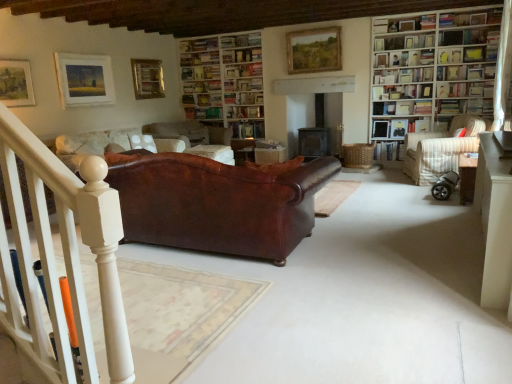
Question: Which direction should I rotate to look at metallic gold picture frame at upper center, which appears as the third picture frame when viewed from the left, — up or down?

Choices:
 (A) up
 (B) down

Answer: (A)

Question: Is brown leather cushion at center facing towards hardcover book at upper right, the eighth book positioned from the left?

Choices:
 (A) yes
 (B) no

Answer: (B)

Question: Is brown leather cushion at center wider than hardcover book at upper right, acting as the first book starting from the right?

Choices:
 (A) no
 (B) yes

Answer: (B)

Question: Can you confirm if brown leather cushion at center is thinner than hardcover book at upper right, acting as the first book starting from the right?

Choices:
 (A) no
 (B) yes

Answer: (A)

Question: From a real-world perspective, is brown leather cushion at center located higher than hardcover book at upper right, acting as the first book starting from the right?

Choices:
 (A) no
 (B) yes

Answer: (A)

Question: Does brown leather cushion at center appear on the left side of hardcover book at upper right, acting as the first book starting from the right?

Choices:
 (A) yes
 (B) no

Answer: (A)

Question: Is brown leather cushion at center shorter than hardcover book at upper right, acting as the first book starting from the right?

Choices:
 (A) yes
 (B) no

Answer: (B)

Question: Is matte wooden picture frame at upper left, which is counted as the first picture frame, starting from the front, facing towards hardcover book at upper right, acting as the first book starting from the right?

Choices:
 (A) no
 (B) yes

Answer: (A)

Question: Is matte wooden picture frame at upper left, positioned as the 1th picture frame in left-to-right order, positioned with its back to hardcover book at upper right, acting as the first book starting from the right?

Choices:
 (A) no
 (B) yes

Answer: (A)

Question: Is the position of matte wooden picture frame at upper left, the 4th picture frame from the back, less distant than that of hardcover book at upper right, the eighth book positioned from the left?

Choices:
 (A) yes
 (B) no

Answer: (A)

Question: Could hardcover book at upper right, acting as the first book starting from the right, be considered to be inside matte wooden picture frame at upper left, which is counted as the first picture frame, starting from the front?

Choices:
 (A) yes
 (B) no

Answer: (B)

Question: From the image's perspective, would you say matte wooden picture frame at upper left, the 4th picture frame from the back, is positioned over hardcover book at upper right, acting as the first book starting from the right?

Choices:
 (A) yes
 (B) no

Answer: (A)

Question: Considering the relative positions of matte wooden picture frame at upper left, positioned as the 1th picture frame in left-to-right order, and hardcover book at upper right, acting as the first book starting from the right, in the image provided, is matte wooden picture frame at upper left, positioned as the 1th picture frame in left-to-right order, to the right of hardcover book at upper right, acting as the first book starting from the right, from the viewer's perspective?

Choices:
 (A) yes
 (B) no

Answer: (B)

Question: Can you confirm if white wooden bookcase at right, the second bookcase from the back, is positioned to the left of hardcover book at upper right, the eighth book positioned from the left?

Choices:
 (A) no
 (B) yes

Answer: (B)